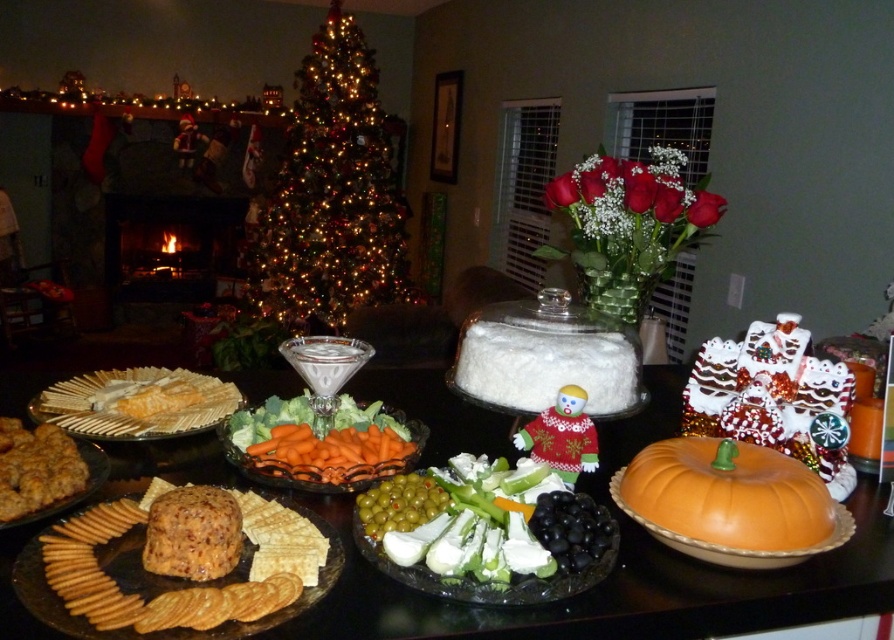
Question: Can you confirm if white cracker at center-left is positioned to the right of green glossy olives at center?

Choices:
 (A) no
 (B) yes

Answer: (A)

Question: Is matte orange pumpkin at center smaller than green glossy olives at center?

Choices:
 (A) no
 (B) yes

Answer: (A)

Question: Which object is the closest to the green glossy olives at center?

Choices:
 (A) matte orange pumpkin at center
 (B) black glossy grapes at center
 (C) brown crumbly cheese ball at center
 (D) orange glazed carrots at center

Answer: (D)

Question: Which of the following is the farthest from the observer?

Choices:
 (A) (567, 499)
 (B) (410, 497)
 (C) (105, 403)
 (D) (34, 509)

Answer: (C)

Question: In this image, where is matte orange pumpkin at center located relative to orange glossy pumpkin at lower right?

Choices:
 (A) left
 (B) right

Answer: (A)

Question: Which object is the farthest from the green artificial christmas tree at center?

Choices:
 (A) orange glossy pumpkin at lower right
 (B) brown cracker at lower left
 (C) matte orange pumpkin at center

Answer: (A)